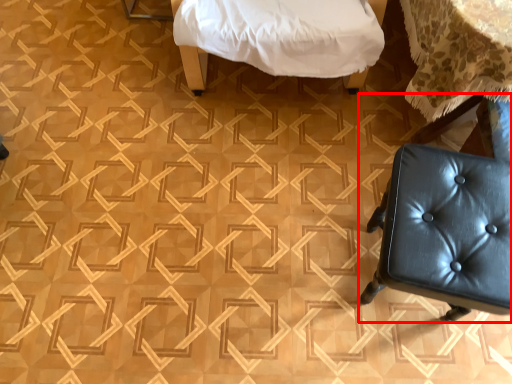
Question: From the image, what is the correct spatial relationship of chair (annotated by the red box) in relation to furniture?

Choices:
 (A) left
 (B) right

Answer: (B)